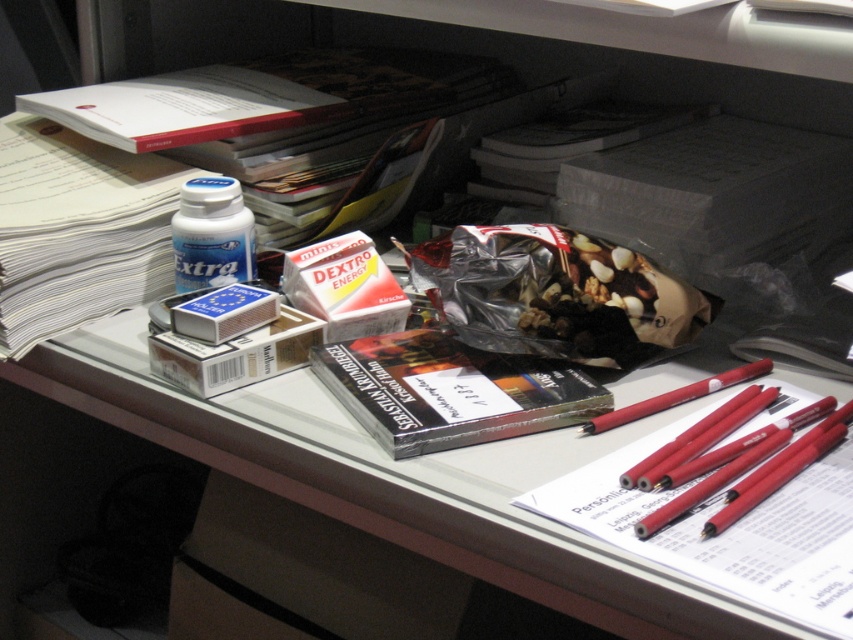
Question: Is white glossy pill bottle at upper left to the right of red matte pencil at right from the viewer's perspective?

Choices:
 (A) yes
 (B) no

Answer: (B)

Question: Is matte plastic table at center thinner than white glossy pill bottle at upper left?

Choices:
 (A) no
 (B) yes

Answer: (A)

Question: Can you confirm if matte plastic table at center is positioned to the right of red matte pencil at right?

Choices:
 (A) yes
 (B) no

Answer: (B)

Question: Estimate the real-world distances between objects in this image. Which object is farther from the matte plastic table at center?

Choices:
 (A) red matte pencil at right
 (B) white glossy pill bottle at upper left

Answer: (B)

Question: Based on their relative distances, which object is farther from the red matte pencil at right?

Choices:
 (A) matte plastic table at center
 (B) white glossy pill bottle at upper left

Answer: (B)

Question: Which is farther from the red matte pencil at right?

Choices:
 (A) white glossy pill bottle at upper left
 (B) matte plastic table at center

Answer: (A)